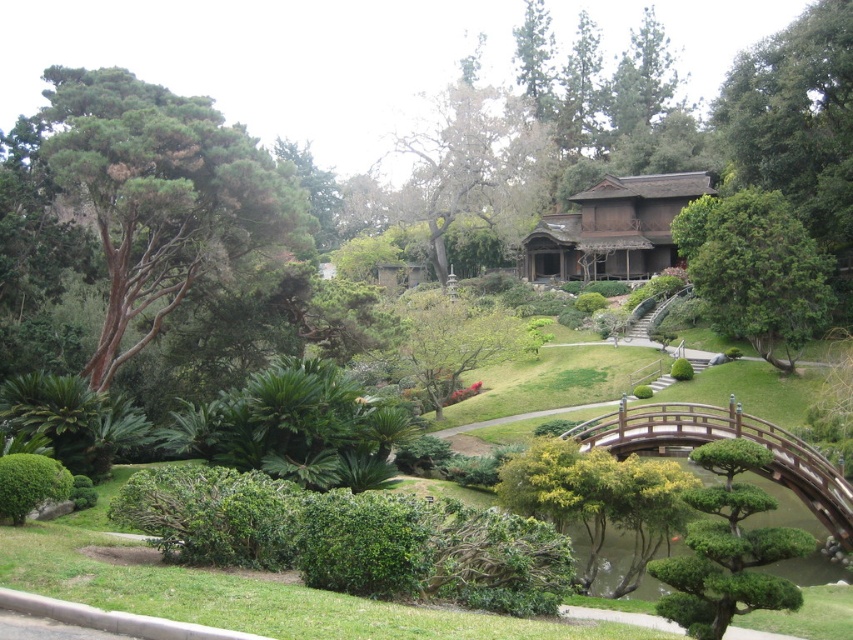
You are standing in the garden and want to reach the point at coordinates point (761, 232). If you can walk 150 feet in 5 minutes, how long will it take you to reach the point?

The point (761, 232) is 135.49 feet away. Since you can walk 150 feet in 5 minutes, it will take approximately 4.5 minutes to reach the point.